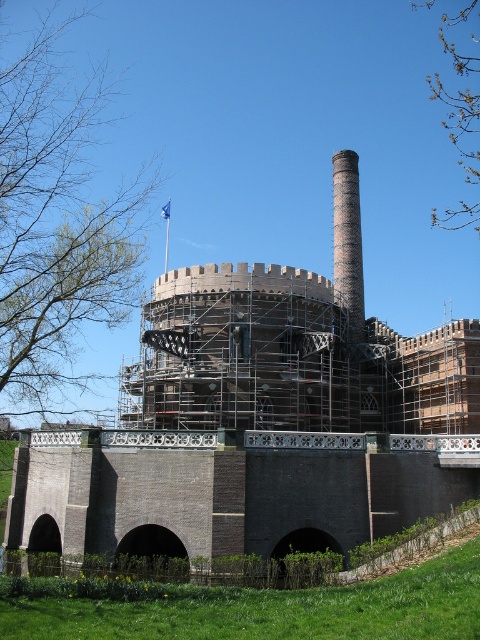
Question: Which object appears closest to the camera in this image?

Choices:
 (A) brick scaffolding at center
 (B) brick chimney at center

Answer: (A)

Question: Is brick scaffolding at center closer to the viewer compared to brick chimney at center?

Choices:
 (A) yes
 (B) no

Answer: (A)

Question: Is brick scaffolding at center behind brick chimney at center?

Choices:
 (A) no
 (B) yes

Answer: (A)

Question: Is brick scaffolding at center thinner than brick chimney at center?

Choices:
 (A) no
 (B) yes

Answer: (A)